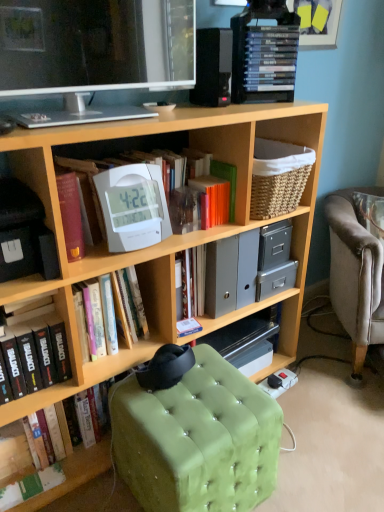
At what (x,y) coordinates should I click in order to perform the action: click on blank space situated above green tufted ottoman at lower center (from a real-world perspective). Please return your answer as a coordinate pair (x, y). Looking at the image, I should click on (201, 396).